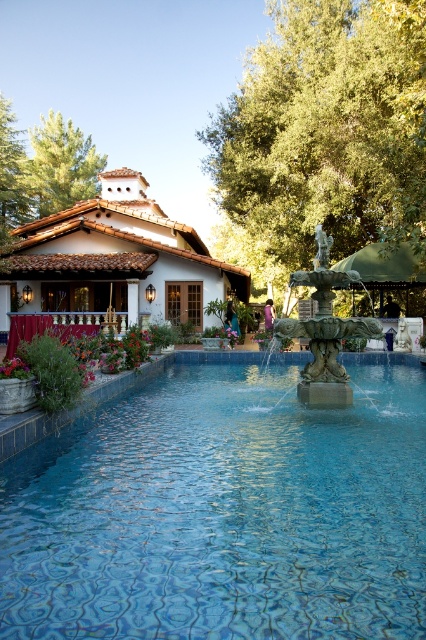
Can you confirm if blue tile swimming pool at center is taller than green stone fountain at center?

In fact, blue tile swimming pool at center may be shorter than green stone fountain at center.

Which is above, blue tile swimming pool at center or green stone fountain at center?

green stone fountain at center is higher up.

Which is behind, point (115, 586) or point (337, 392)?

The point (337, 392) is behind.

Locate an element on the screen. blue tile swimming pool at center is located at coordinates (224, 509).